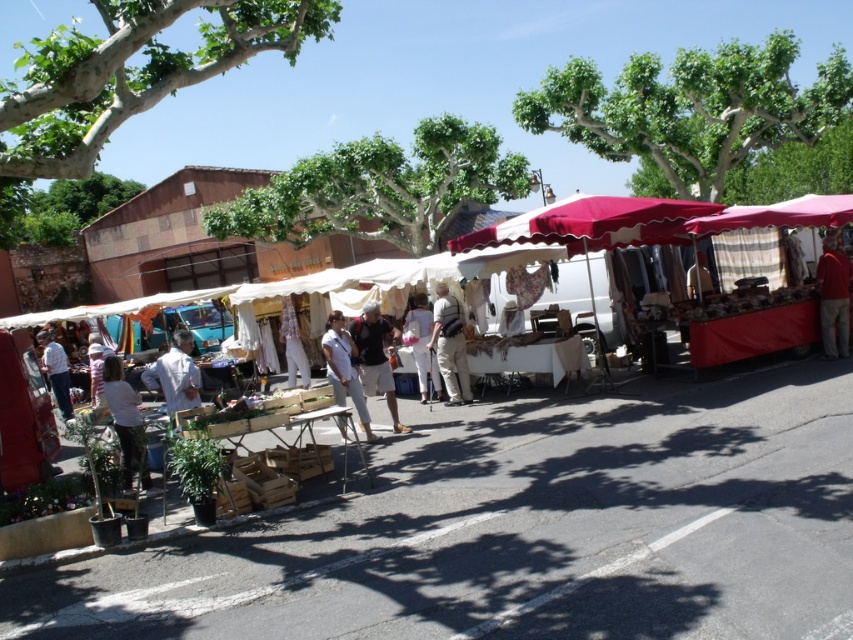
Can you confirm if matte brown backpack at center is positioned to the left of light brown leather backpack at center?

Correct, you'll find matte brown backpack at center to the left of light brown leather backpack at center.

Does matte brown backpack at center have a smaller size compared to light brown leather backpack at center?

No, matte brown backpack at center is not smaller than light brown leather backpack at center.

From the picture: Measure the distance between matte brown backpack at center and camera.

A distance of 8.76 meters exists between matte brown backpack at center and camera.

The height and width of the screenshot is (640, 853). What are the coordinates of `matte brown backpack at center` in the screenshot? It's located at point(375,356).

Can you confirm if red cotton shirt at right is taller than light brown leather backpack at center?

No.

Is point (831, 266) closer to viewer compared to point (456, 371)?

Yes, it is.

The image size is (853, 640). Identify the location of red cotton shirt at right. (833, 296).

Describe the element at coordinates (375, 356) in the screenshot. I see `matte brown backpack at center` at that location.

Can you confirm if matte brown backpack at center is positioned above light brown leather jacket at left?

Indeed, matte brown backpack at center is positioned over light brown leather jacket at left.

Image resolution: width=853 pixels, height=640 pixels. I want to click on matte brown backpack at center, so click(x=375, y=356).